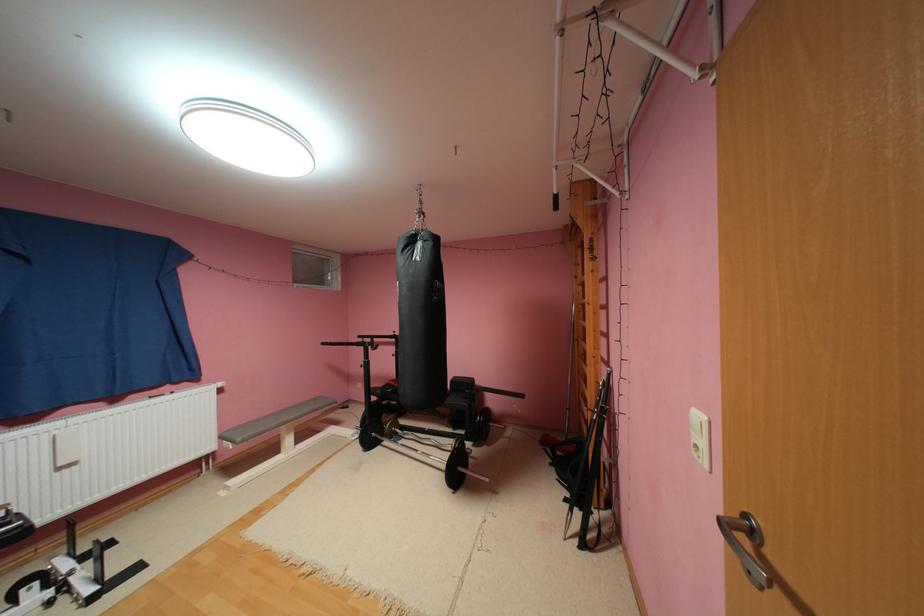
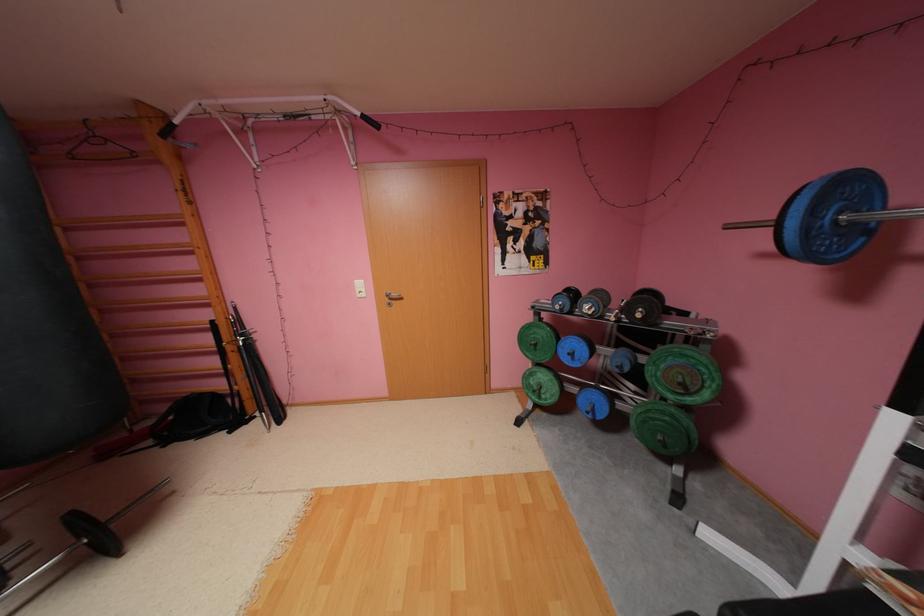
In the second image, find the point that corresponds to [602,369] in the first image.

(227, 308)